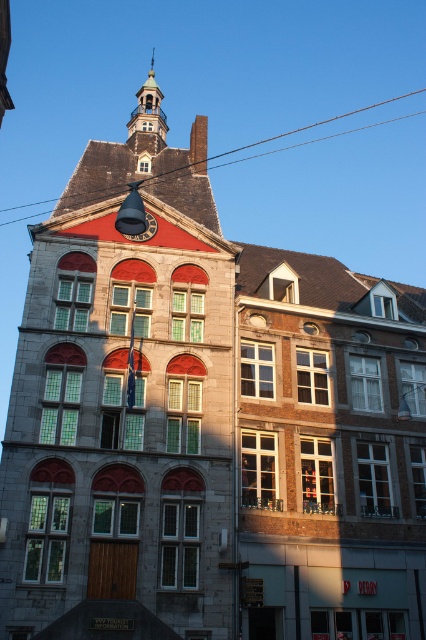
Question: Does polished brass bell tower at center lie behind gold polished metal spire at upper center?

Choices:
 (A) no
 (B) yes

Answer: (A)

Question: Is polished brass bell tower at center further to the viewer compared to gold polished metal spire at upper center?

Choices:
 (A) yes
 (B) no

Answer: (B)

Question: Which point is farther from the camera taking this photo?

Choices:
 (A) (157, 188)
 (B) (137, 147)

Answer: (B)

Question: Does polished brass bell tower at center have a lesser width compared to gold polished metal spire at upper center?

Choices:
 (A) no
 (B) yes

Answer: (B)